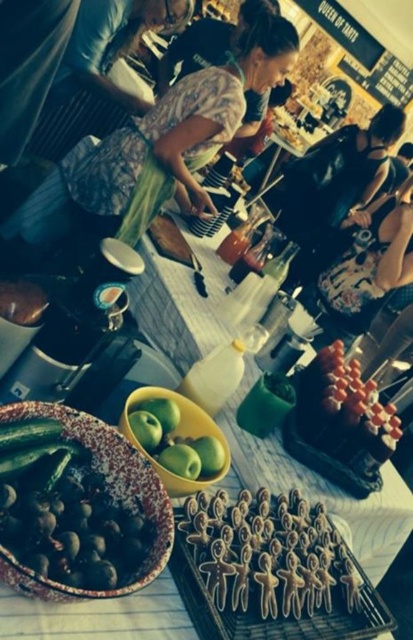
Between point (87, 232) and point (132, 422), which one is positioned behind?

The point (87, 232) is behind.

Between camouflage fabric apron at center and green matte apples at center, which one has more height?

camouflage fabric apron at center is taller.

Is point (177, 90) in front of point (215, 433)?

That is False.

I want to click on camouflage fabric apron at center, so click(151, 150).

Which is behind, point (156, 112) or point (270, 522)?

Positioned behind is point (156, 112).

Is camouflage fabric apron at center positioned in front of brown sugar cookies at center?

No.

This screenshot has height=640, width=413. What are the coordinates of `camouflage fabric apron at center` in the screenshot? It's located at (151, 150).

Between camouflage fabric apron at center and speckled ceramic bowl of olives at center-left, which one appears on the right side from the viewer's perspective?

camouflage fabric apron at center

Which is in front, point (294, 60) or point (156, 576)?

Positioned in front is point (156, 576).

Who is more distant from viewer, (227,72) or (168,532)?

The point (227,72) is behind.

Locate an element on the screen. This screenshot has height=640, width=413. camouflage fabric apron at center is located at coordinates (151, 150).